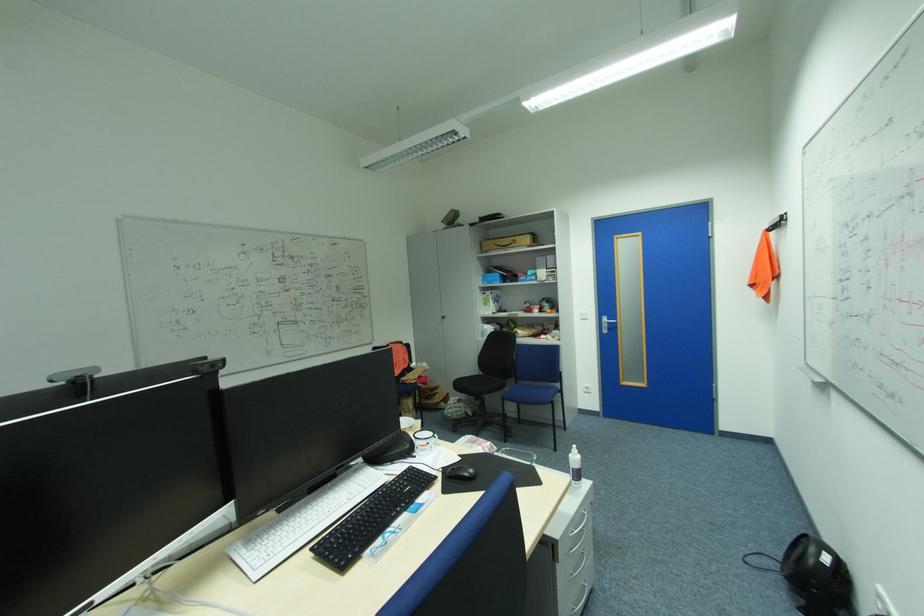
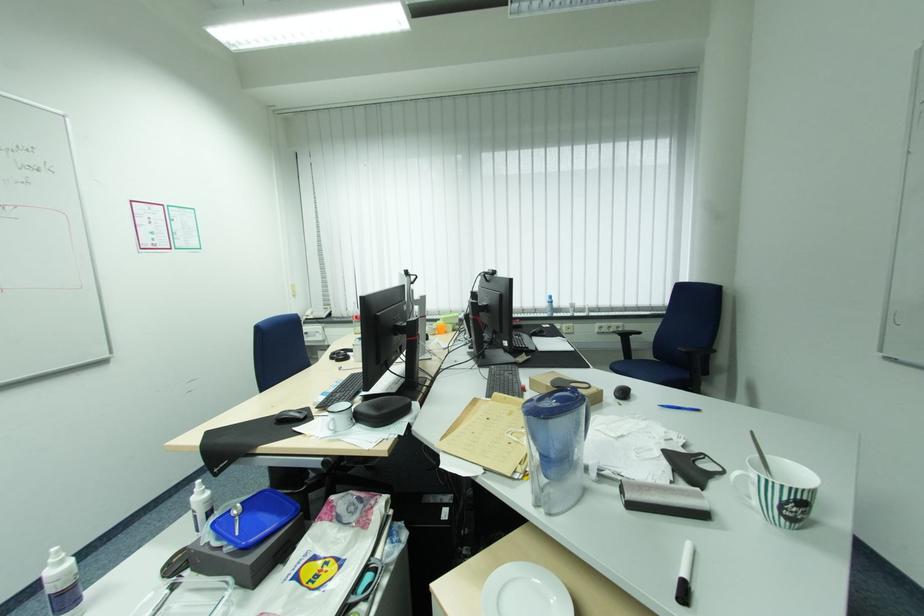
Find the pixel in the second image that matches point (580, 446) in the first image.

(62, 548)